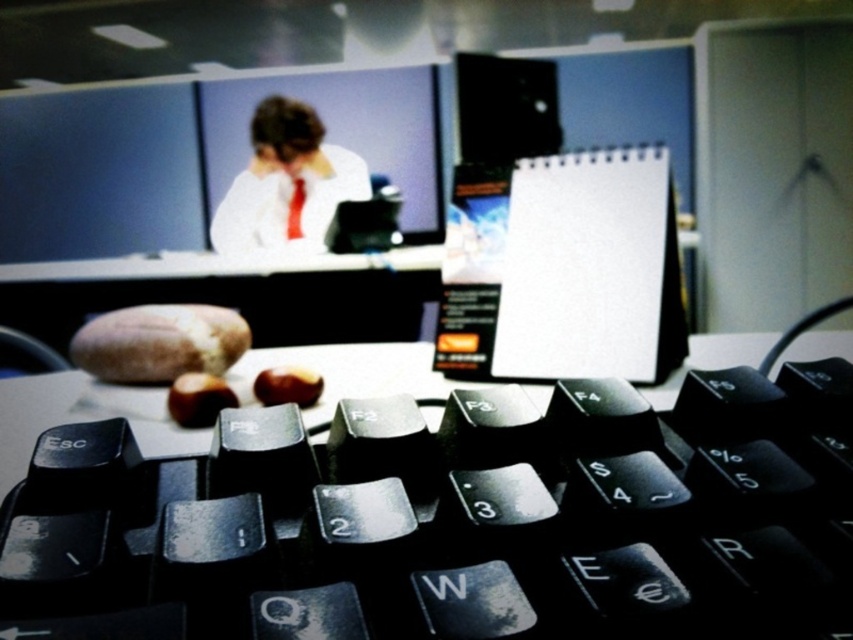
Does black glossy monitor at upper center have a lesser width compared to matte red tie at center?

In fact, black glossy monitor at upper center might be wider than matte red tie at center.

Describe the element at coordinates (503, 108) in the screenshot. I see `black glossy monitor at upper center` at that location.

Is point (474, 116) behind point (302, 200)?

No, it is not.

Locate an element on the screen. black glossy monitor at upper center is located at coordinates (503, 108).

From the picture: Who is higher up, white glossy shirt at upper center or matte red tie at center?

Positioned higher is white glossy shirt at upper center.

The image size is (853, 640). Describe the element at coordinates (286, 179) in the screenshot. I see `white glossy shirt at upper center` at that location.

You are a GUI agent. You are given a task and a screenshot of the screen. Output one action in this format:
    pyautogui.click(x=<x>, y=<y>)
    Task: Click on the white glossy shirt at upper center
    
    Given the screenshot: What is the action you would take?
    pyautogui.click(x=286, y=179)

Does black plastic keyboard at lower center appear on the left side of white glossy shirt at upper center?

Incorrect, black plastic keyboard at lower center is not on the left side of white glossy shirt at upper center.

Find the location of `black plastic keyboard at lower center`. black plastic keyboard at lower center is located at coordinates (453, 518).